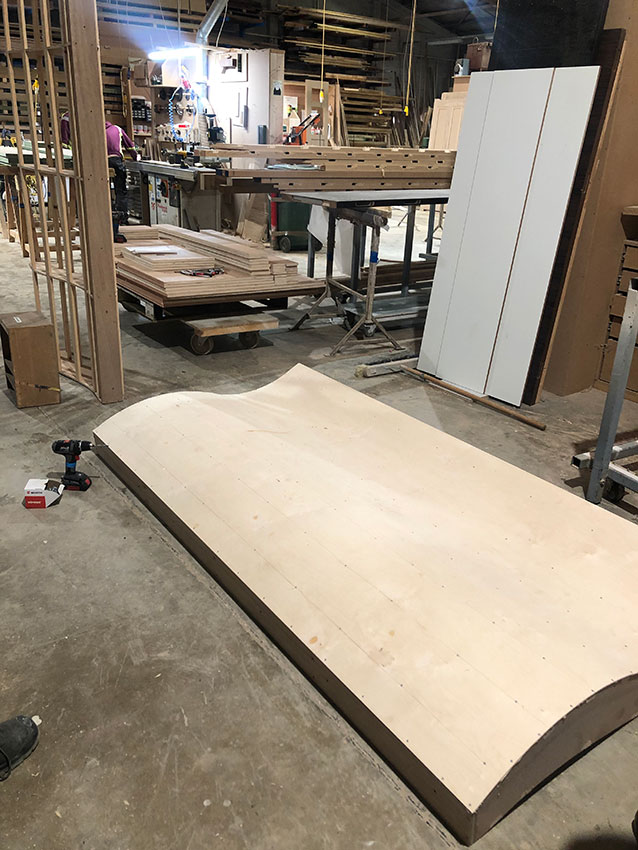
This screenshot has width=638, height=850. Identify the location of white colored planks. (508, 168).